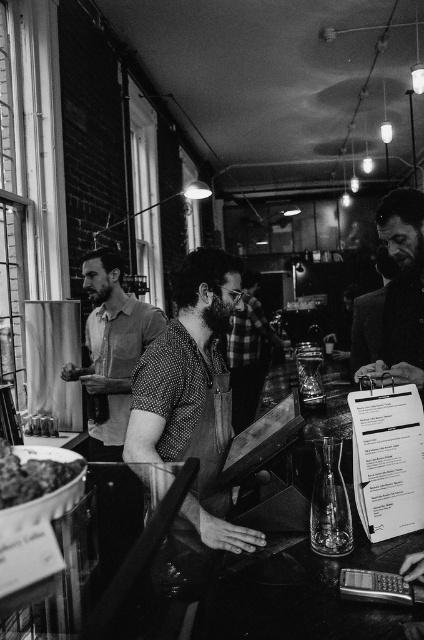
Question: Does smooth leather jacket at right appear over dark textured salad bowl at lower left?

Choices:
 (A) no
 (B) yes

Answer: (B)

Question: Which is nearer to the white paper menu at center?

Choices:
 (A) smooth leather jacket at right
 (B) dark textured salad bowl at lower left
 (C) polka dot shirt at center
 (D) dotted shirt at center

Answer: (A)

Question: Which point is farther to the camera?

Choices:
 (A) white paper menu at center
 (B) dotted shirt at center
 (C) smooth leather jacket at right
 (D) polka dot shirt at center

Answer: (B)

Question: In this image, where is polka dot shirt at center located relative to dark textured salad bowl at lower left?

Choices:
 (A) above
 (B) below

Answer: (B)

Question: Where is dotted shirt at center located in relation to dark textured salad bowl at lower left in the image?

Choices:
 (A) below
 (B) above

Answer: (B)

Question: Which point is farther to the camera?

Choices:
 (A) dark textured salad bowl at lower left
 (B) smooth leather jacket at right
 (C) dotted shirt at center
 (D) white paper menu at center

Answer: (C)